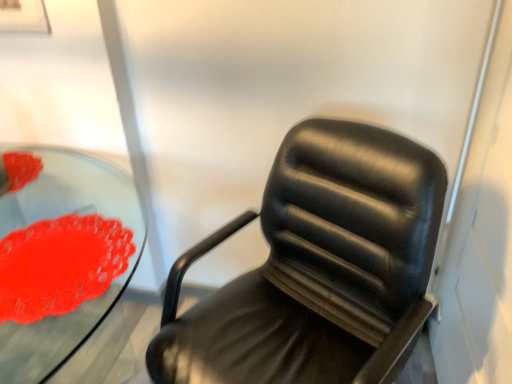
Question: Does point (352, 218) appear closer or farther from the camera than point (31, 259)?

Choices:
 (A) farther
 (B) closer

Answer: (A)

Question: Is black leather chair at center bigger or smaller than rubberized red flower at left?

Choices:
 (A) small
 (B) big

Answer: (B)

Question: Which object is positioned farthest from the transparent glass table at center?

Choices:
 (A) rubberized red flower at left
 (B) black leather chair at center

Answer: (B)

Question: Estimate the real-world distances between objects in this image. Which object is farther from the black leather chair at center?

Choices:
 (A) transparent glass table at center
 (B) rubberized red flower at left

Answer: (A)